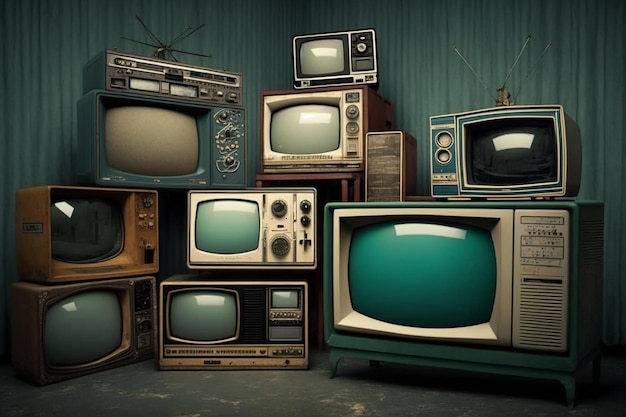
Find the location of a particular element. television screen is located at coordinates click(x=74, y=322), click(x=101, y=240), click(x=144, y=150), click(x=317, y=47), click(x=305, y=120), click(x=221, y=235), click(x=196, y=309), click(x=403, y=277), click(x=529, y=135).